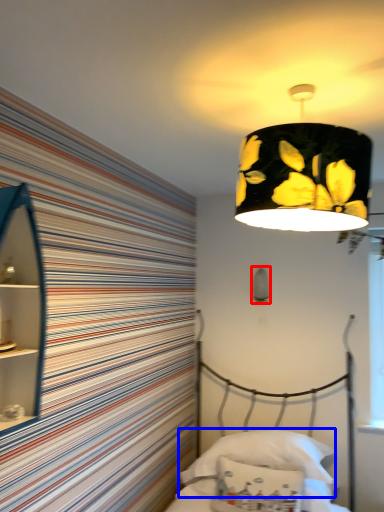
Question: Which object is further to the camera taking this photo, lamp (highlighted by a red box) or pillow (highlighted by a blue box)?

Choices:
 (A) lamp
 (B) pillow

Answer: (A)